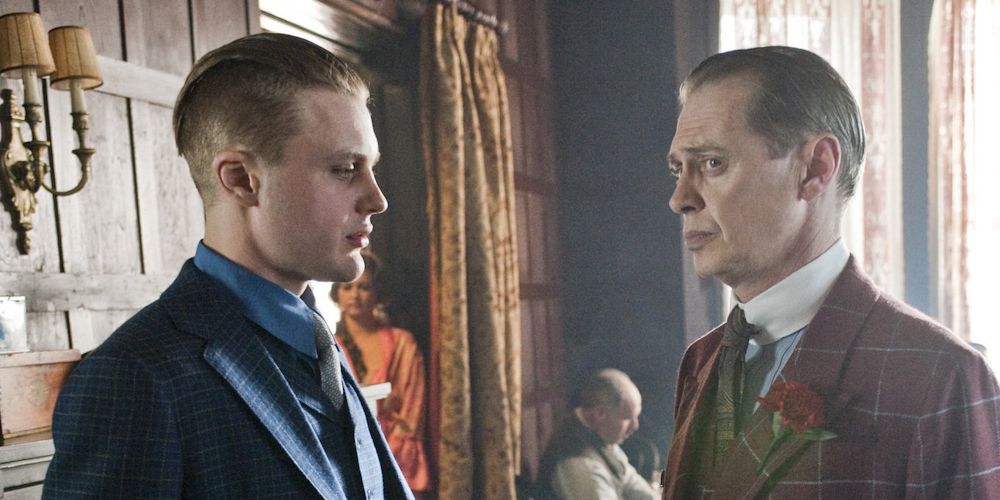
Locate an element on the screen. This screenshot has width=1000, height=500. curtains is located at coordinates (476, 121), (836, 18), (947, 32).